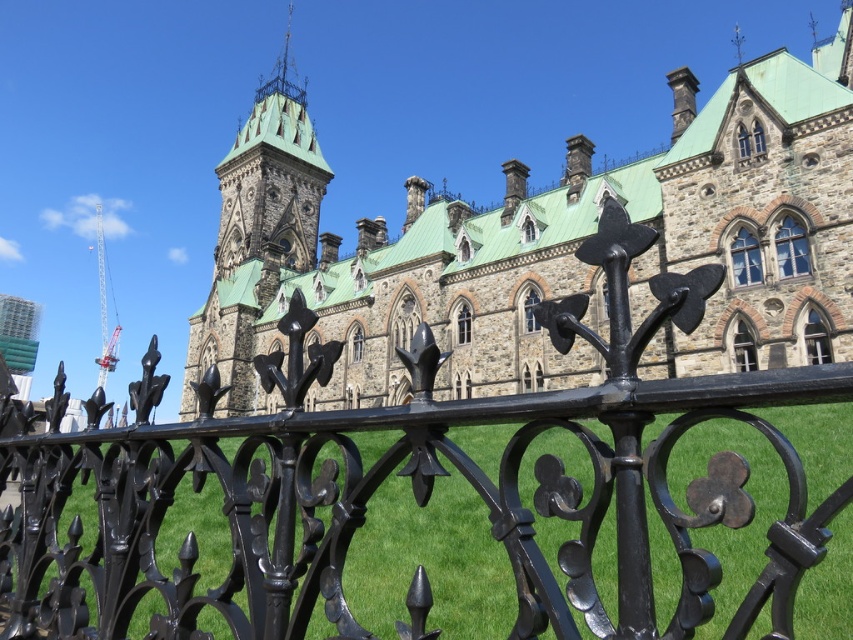
Is point (30, 438) positioned before point (247, 253)?

Yes, point (30, 438) is in front of point (247, 253).

Does black wrought iron fence at center have a smaller size compared to green stone tower at upper center?

Indeed, black wrought iron fence at center has a smaller size compared to green stone tower at upper center.

Describe the element at coordinates (410, 481) in the screenshot. The width and height of the screenshot is (853, 640). I see `black wrought iron fence at center` at that location.

The width and height of the screenshot is (853, 640). In order to click on black wrought iron fence at center in this screenshot , I will do `click(410, 481)`.

Between stone church at center and green stone tower at upper center, which one appears on the right side from the viewer's perspective?

stone church at center

Does stone church at center have a greater width compared to green stone tower at upper center?

Correct, the width of stone church at center exceeds that of green stone tower at upper center.

Is point (242, 346) farther from viewer compared to point (277, 248)?

No, (242, 346) is closer to viewer.

Locate an element on the screen. stone church at center is located at coordinates (547, 244).

Does black wrought iron fence at center have a greater height compared to stone church at center?

Incorrect, black wrought iron fence at center's height is not larger of stone church at center's.

Is black wrought iron fence at center positioned at the back of stone church at center?

No, black wrought iron fence at center is closer to the viewer.

At what (x,y) coordinates should I click in order to perform the action: click on black wrought iron fence at center. Please return your answer as a coordinate pair (x, y). The width and height of the screenshot is (853, 640). Looking at the image, I should click on (410, 481).